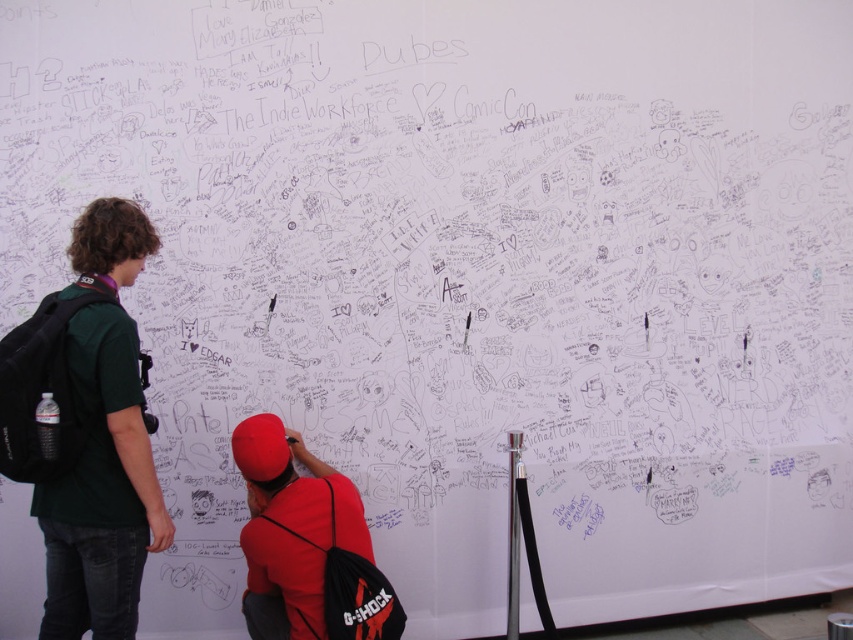
This screenshot has height=640, width=853. Find the location of `green matte shirt at left`. green matte shirt at left is located at coordinates (102, 488).

Does point (90, 259) come farther from viewer compared to point (294, 556)?

No.

Image resolution: width=853 pixels, height=640 pixels. What are the coordinates of `green matte shirt at left` in the screenshot? It's located at (102, 488).